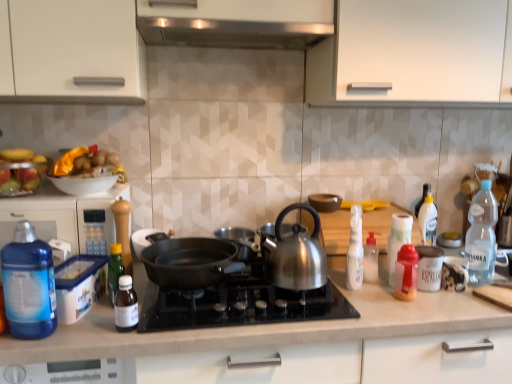
Find the location of a particular element. This screenshot has width=512, height=384. unoccupied area in front of green glass bottle at left, the 7th bottle from the right is located at coordinates (92, 328).